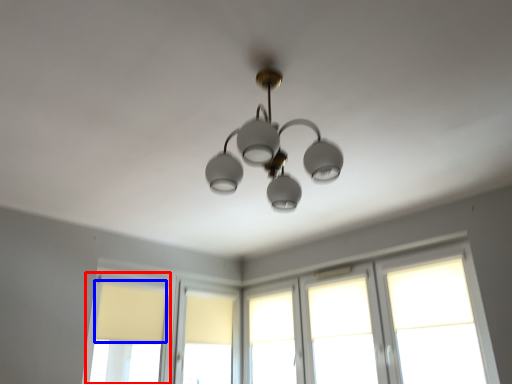
Question: Which of the following is the closest to the observer, window (highlighted by a red box) or curtain (highlighted by a blue box)?

Choices:
 (A) window
 (B) curtain

Answer: (A)